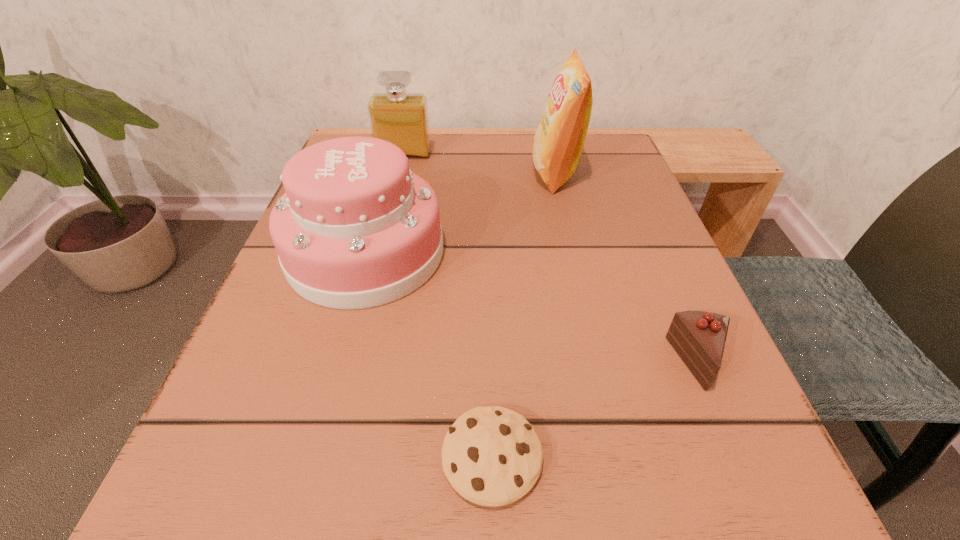
Identify the location of crisp (potato chip) that is at the right edge. (558, 143).

Image resolution: width=960 pixels, height=540 pixels. I want to click on chocolate cake that is at the right edge, so click(x=699, y=337).

Locate an element on the screen. The image size is (960, 540). object located at the far left corner is located at coordinates (401, 118).

In order to click on object at the far right corner in this screenshot , I will do `click(558, 143)`.

The width and height of the screenshot is (960, 540). In the image, there is a desktop. Identify the location of blank space at the far edge. (523, 134).

The height and width of the screenshot is (540, 960). I want to click on vacant space at the left edge, so click(x=273, y=298).

In the image, there is a desktop. Where is `vacant space at the right edge`? Image resolution: width=960 pixels, height=540 pixels. vacant space at the right edge is located at coordinates (643, 428).

You are a GUI agent. You are given a task and a screenshot of the screen. Output one action in this format:
    pyautogui.click(x=<x>, y=<y>)
    Task: Click on the vacant area at the near left corner
    This screenshot has width=960, height=540.
    Given the screenshot: What is the action you would take?
    pyautogui.click(x=315, y=479)

At what (x,y) coordinates should I click in order to perform the action: click on free location at the far right corner of the desktop. Please return your answer as a coordinate pair (x, y). The height and width of the screenshot is (540, 960). Looking at the image, I should click on (573, 191).

I want to click on vacant position at the near right corner of the desktop, so click(749, 496).